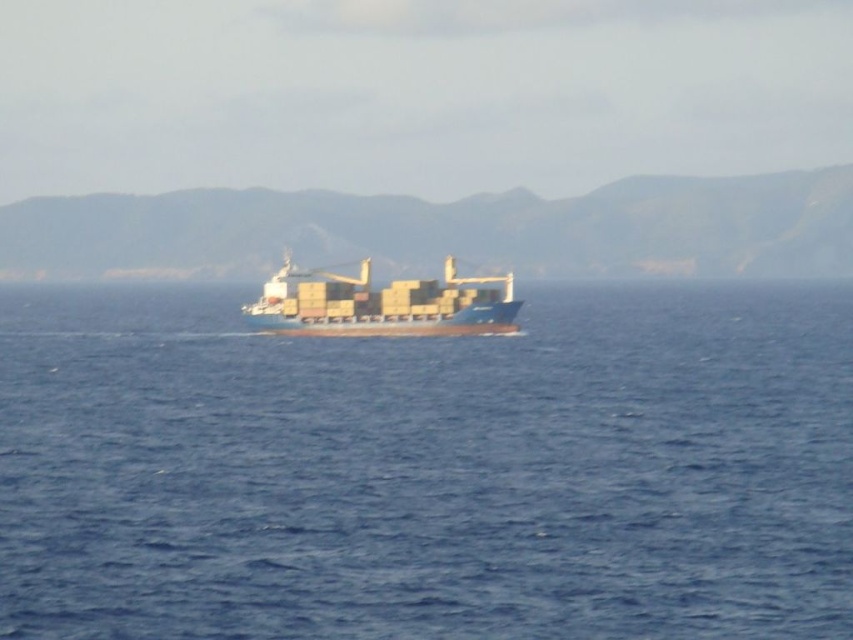
You are a sailor on the blue matte container ship at center. You notice the blue water at center below you. Can you confirm if the water is directly underneath the ship?

Yes, the blue water at center is directly below the blue matte container ship at center, so the water is indeed underneath the ship.

You are a sailor on the blue matte container ship at center. You look around and see the blue water at center. Which one is taller between the two?

The blue matte container ship at center is taller than the blue water at center.